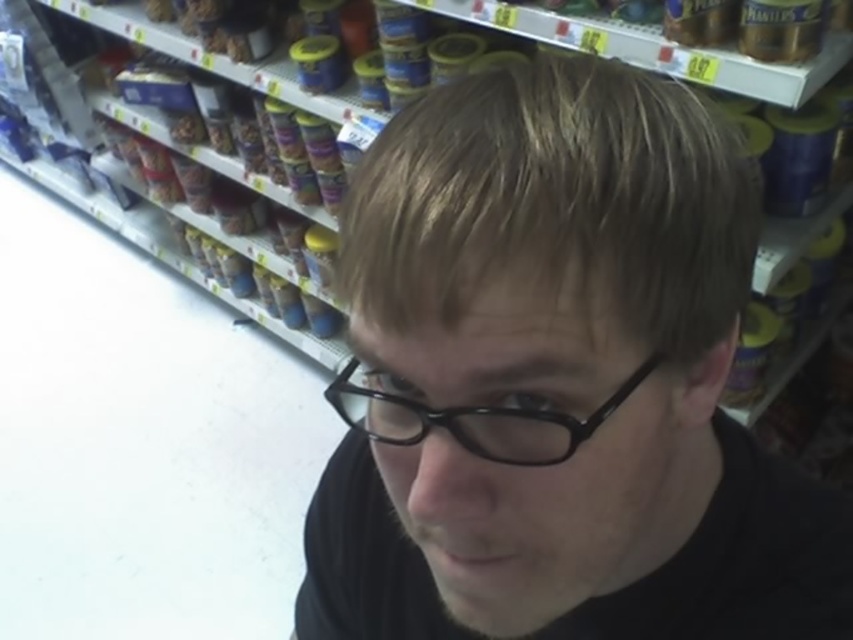
Question: Which of the following is the farthest from the observer?

Choices:
 (A) (155, 141)
 (B) (570, 449)
 (C) (596, 348)

Answer: (A)

Question: Which is nearer to the black matte glasses at center?

Choices:
 (A) black plastic glasses at center
 (B) yellow plastic jars at upper center

Answer: (A)

Question: Can you confirm if black matte glasses at center is wider than yellow plastic jars at upper center?

Choices:
 (A) yes
 (B) no

Answer: (B)

Question: Does black matte glasses at center lie behind black plastic glasses at center?

Choices:
 (A) no
 (B) yes

Answer: (A)

Question: Which of the following is the closest to the observer?

Choices:
 (A) tap(321, 122)
 (B) tap(419, 429)
 (C) tap(619, 400)

Answer: (C)

Question: Does black matte glasses at center appear on the left side of yellow plastic jars at upper center?

Choices:
 (A) yes
 (B) no

Answer: (B)